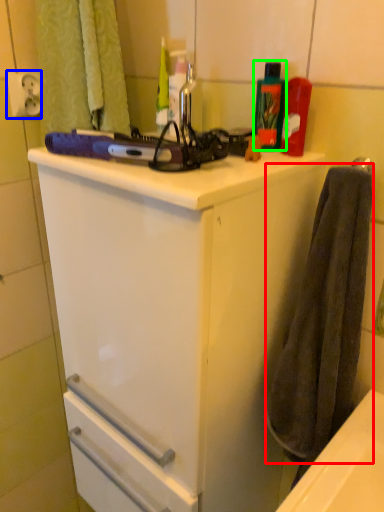
Question: Considering the real-world distances, which object is closest to bath towel (highlighted by a red box)? electric outlet (highlighted by a blue box) or cleaning product (highlighted by a green box).

Choices:
 (A) electric outlet
 (B) cleaning product

Answer: (B)